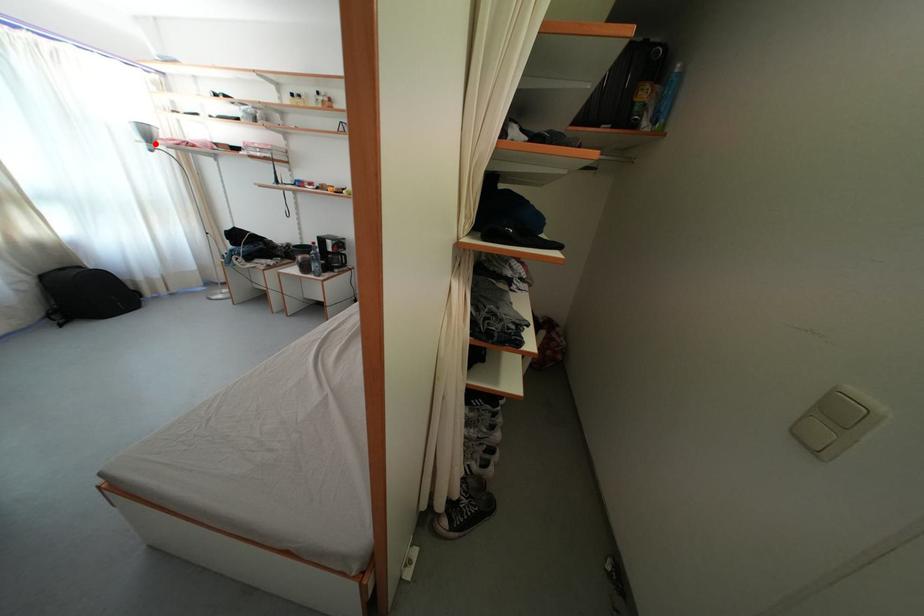
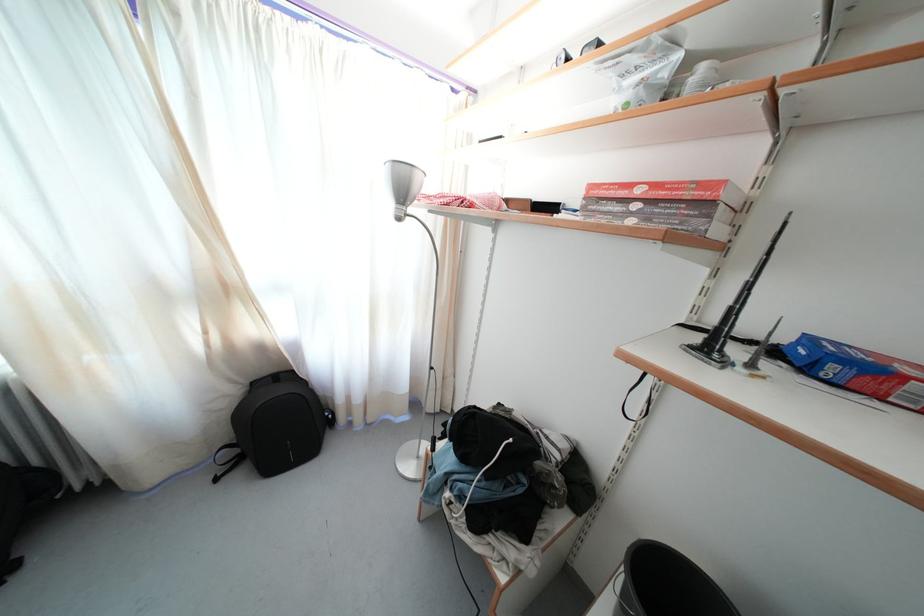
In the second image, find the point that corresponds to the highlighted location in the first image.

(408, 199)